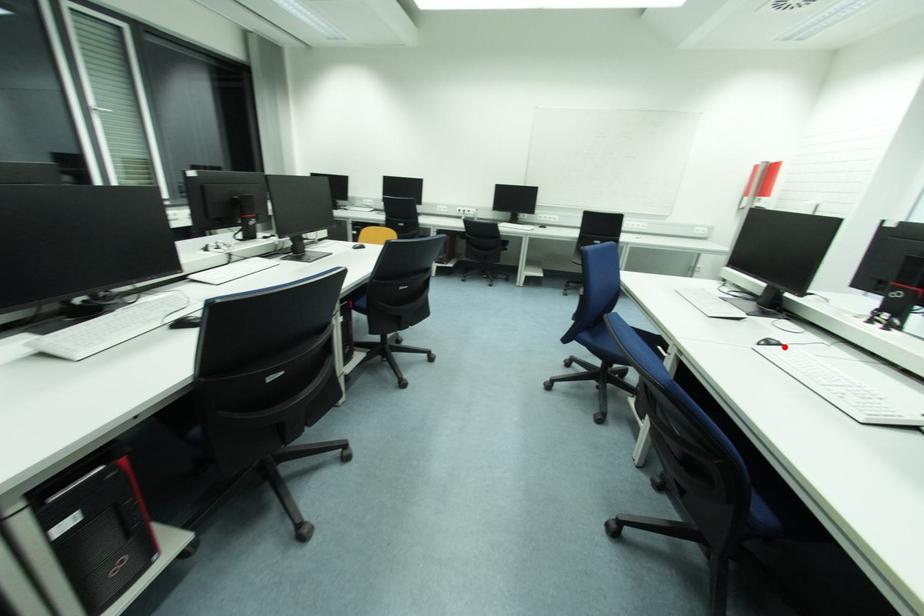
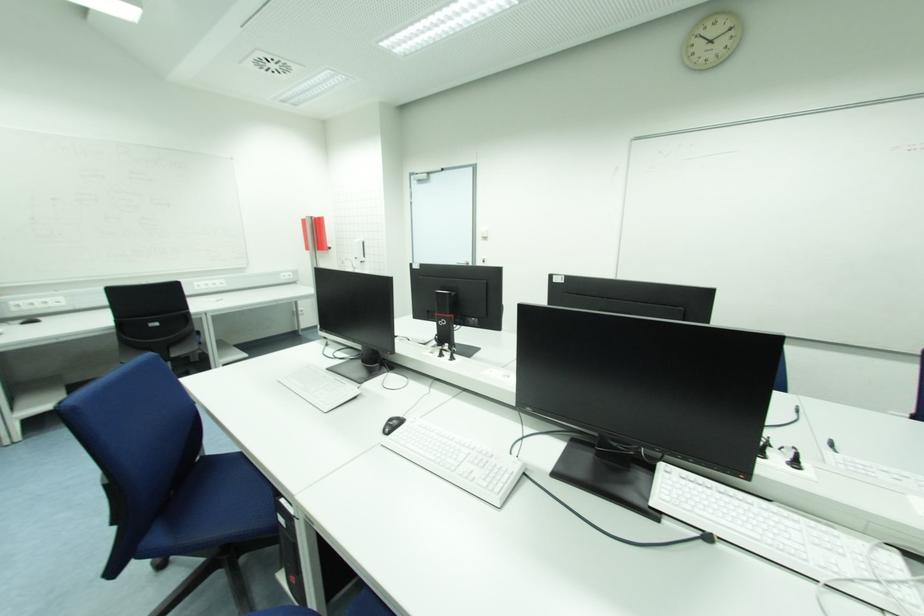
Find the pixel in the second image that matches the highlighted location in the first image.

(405, 422)